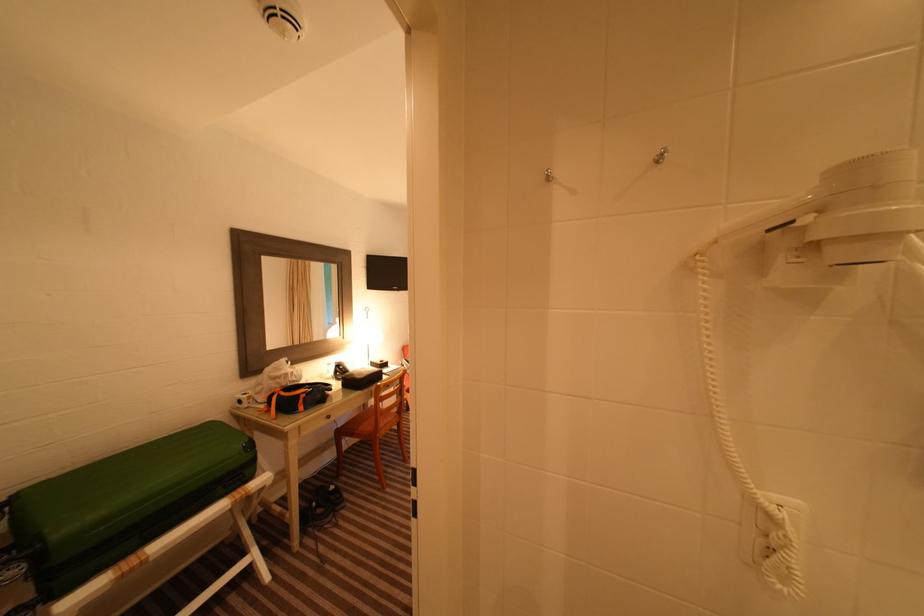
Where would you lift the suitcase handle? Please return your answer as a coordinate pair (x, y).

(17, 583)